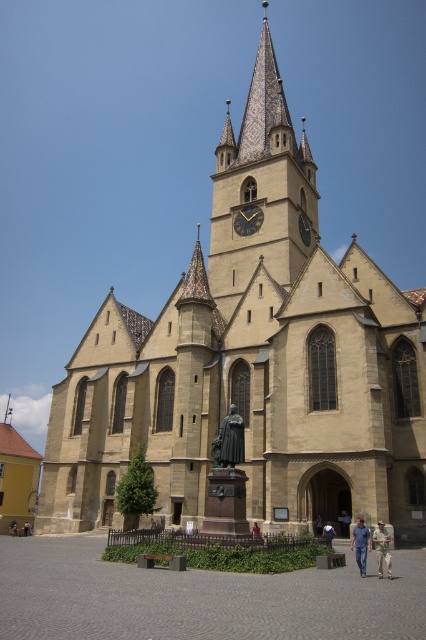
You are standing in front of the church and want to take a photo of both the bronze statue at center and the light brown wooden statue at center. Which statue should you focus on first to ensure both are in frame?

You should focus on the bronze statue at center first because it is closer to the viewer than the light brown wooden statue at center, ensuring both are in frame.

You are standing at point (261, 188) in the image. What object are you directly facing?

You are directly facing the beige stone clock tower at center located at point (261, 188).

You are standing at point [242,435] and want to walk towards the church. Is the point [282,172] behind you or in front of you relative to your direction of movement?

The point [282,172] is behind you relative to your direction of movement towards the church because it is stated to be behind point [242,435].